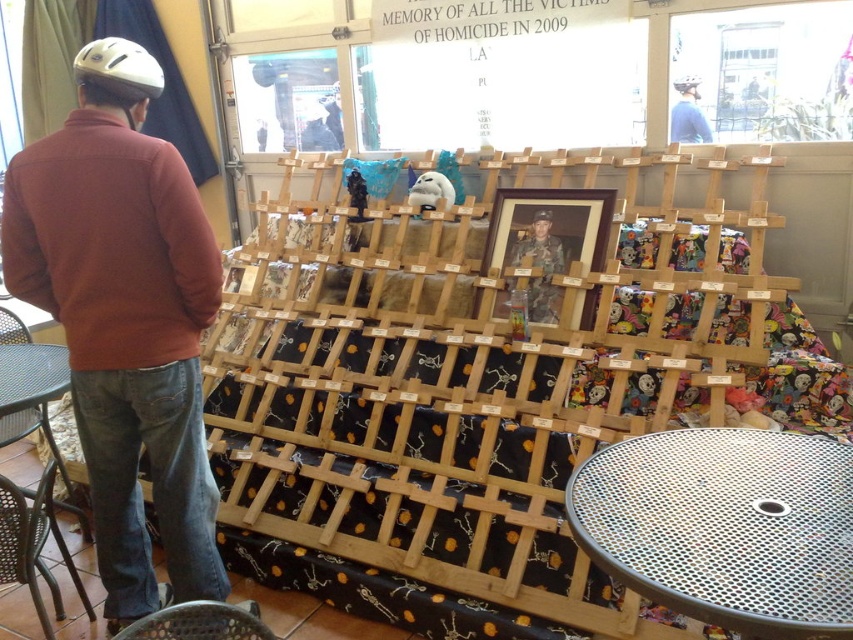
Between metal mesh chair at lower left and matte black helmet at upper center, which one is positioned higher?

matte black helmet at upper center

You are a GUI agent. You are given a task and a screenshot of the screen. Output one action in this format:
    pyautogui.click(x=<x>, y=<y>)
    Task: Click on the metal mesh chair at lower left
    This screenshot has width=853, height=640.
    Given the screenshot: What is the action you would take?
    pyautogui.click(x=199, y=621)

Which of these two, brown cotton jacket at left or matte black helmet at upper center, stands taller?

With more height is brown cotton jacket at left.

Between point (96, 186) and point (676, 104), which one is positioned behind?

The point (676, 104) is behind.

Does point (144, 220) come closer to viewer compared to point (676, 106)?

Yes.

This screenshot has width=853, height=640. In order to click on brown cotton jacket at left in this screenshot , I will do `click(125, 320)`.

Is metal mesh table at lower right bigger than wooden photo frame at center?

Yes, metal mesh table at lower right is bigger than wooden photo frame at center.

Based on the photo, who is taller, metal mesh table at lower right or wooden photo frame at center?

Standing taller between the two is wooden photo frame at center.

Is point (711, 548) positioned in front of point (509, 236)?

Yes, point (711, 548) is in front of point (509, 236).

Identify the location of metal mesh table at lower right. (724, 525).